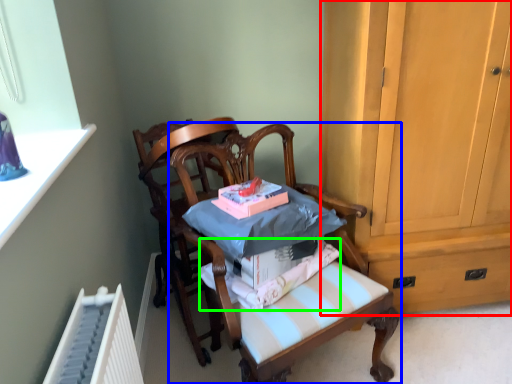
Question: Considering the real-world distances, which object is closest to cabinetry (highlighted by a red box)? chair (highlighted by a blue box) or fabric (highlighted by a green box).

Choices:
 (A) chair
 (B) fabric

Answer: (A)